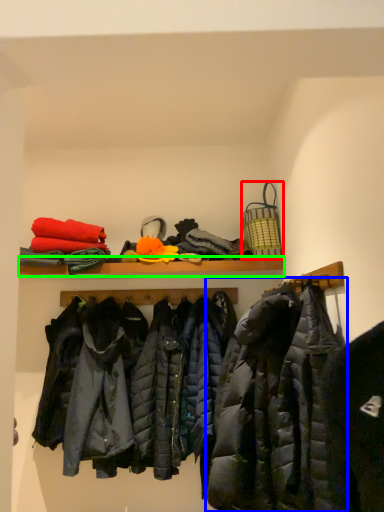
Question: Which object is the farthest from basket (highlighted by a red box)? Choose among these: jacket (highlighted by a blue box) or shelf (highlighted by a green box).

Choices:
 (A) jacket
 (B) shelf

Answer: (A)